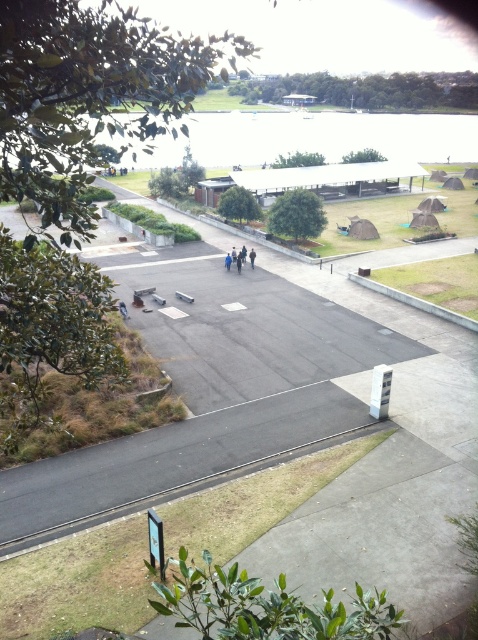
Question: Which object is closer to the camera taking this photo?

Choices:
 (A) brown fabric person at center
 (B) asphalt pavement at center
 (C) clear water at upper center

Answer: (B)

Question: Which point is closer to the camera?

Choices:
 (A) brown fabric person at center
 (B) clear water at upper center
 (C) asphalt pavement at center

Answer: (C)

Question: Can you confirm if asphalt pavement at center is positioned above clear water at upper center?

Choices:
 (A) yes
 (B) no

Answer: (B)

Question: Is clear water at upper center bigger than brown fabric person at center?

Choices:
 (A) no
 (B) yes

Answer: (B)

Question: Estimate the real-world distances between objects in this image. Which object is closer to the brown fabric person at center?

Choices:
 (A) clear water at upper center
 (B) asphalt pavement at center

Answer: (B)

Question: Does asphalt pavement at center have a greater width compared to brown fabric person at center?

Choices:
 (A) yes
 (B) no

Answer: (A)